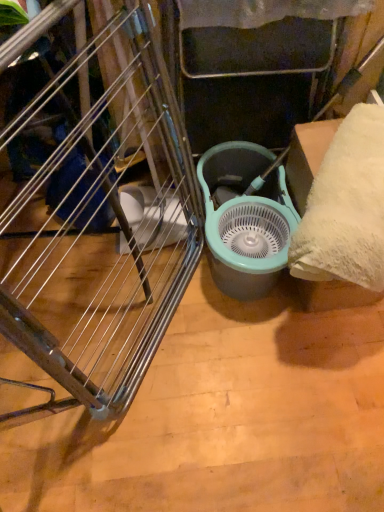
Question: From the image's perspective, is brushed metal drying rack at left over teal plastic mechanical fan at center?

Choices:
 (A) no
 (B) yes

Answer: (A)

Question: Are brushed metal drying rack at left and teal plastic mechanical fan at center beside each other?

Choices:
 (A) yes
 (B) no

Answer: (B)

Question: Is brushed metal drying rack at left further to camera compared to teal plastic mechanical fan at center?

Choices:
 (A) yes
 (B) no

Answer: (B)

Question: Is brushed metal drying rack at left looking in the opposite direction of teal plastic mechanical fan at center?

Choices:
 (A) no
 (B) yes

Answer: (A)

Question: Considering the relative sizes of brushed metal drying rack at left and teal plastic mechanical fan at center in the image provided, is brushed metal drying rack at left shorter than teal plastic mechanical fan at center?

Choices:
 (A) yes
 (B) no

Answer: (B)

Question: Considering the relative sizes of brushed metal drying rack at left and teal plastic mechanical fan at center in the image provided, is brushed metal drying rack at left thinner than teal plastic mechanical fan at center?

Choices:
 (A) yes
 (B) no

Answer: (A)

Question: From the image's perspective, is teal plastic mechanical fan at center below brushed metal drying rack at left?

Choices:
 (A) no
 (B) yes

Answer: (A)

Question: Can you confirm if teal plastic mechanical fan at center is shorter than brushed metal drying rack at left?

Choices:
 (A) no
 (B) yes

Answer: (B)

Question: Considering the relative positions of teal plastic mechanical fan at center and brushed metal drying rack at left in the image provided, is teal plastic mechanical fan at center behind brushed metal drying rack at left?

Choices:
 (A) yes
 (B) no

Answer: (A)

Question: From a real-world perspective, is teal plastic mechanical fan at center below brushed metal drying rack at left?

Choices:
 (A) no
 (B) yes

Answer: (B)

Question: Is teal plastic mechanical fan at center bigger than brushed metal drying rack at left?

Choices:
 (A) no
 (B) yes

Answer: (A)

Question: Is teal plastic mechanical fan at center touching brushed metal drying rack at left?

Choices:
 (A) no
 (B) yes

Answer: (A)

Question: Considering their positions, is teal plastic mechanical fan at center located in front of or behind brushed metal drying rack at left?

Choices:
 (A) behind
 (B) front

Answer: (A)